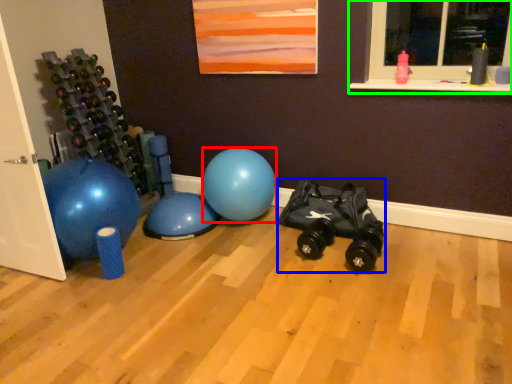
Question: Which is nearer to the ball (highlighted by a red box)? toy car (highlighted by a blue box) or window (highlighted by a green box).

Choices:
 (A) toy car
 (B) window

Answer: (A)